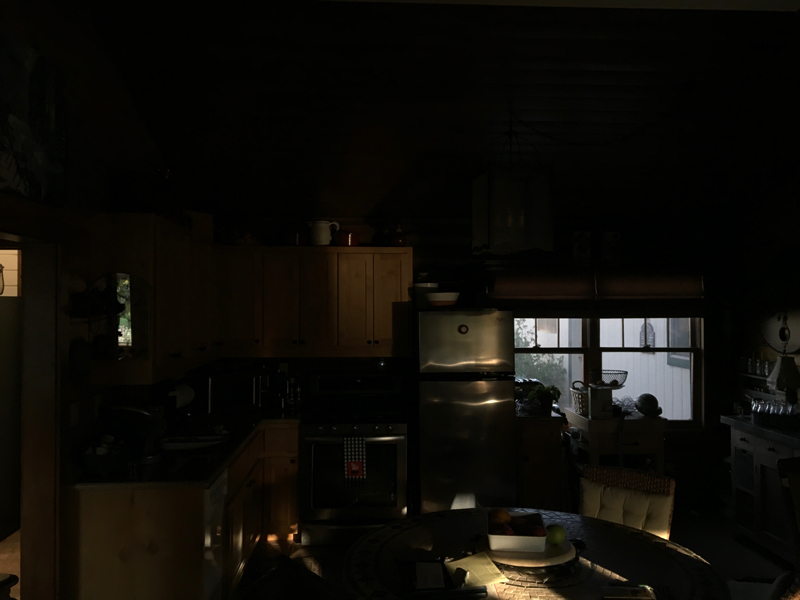
Locate an element on the screen. Image resolution: width=800 pixels, height=600 pixels. kitchen towel is located at coordinates (358, 454).